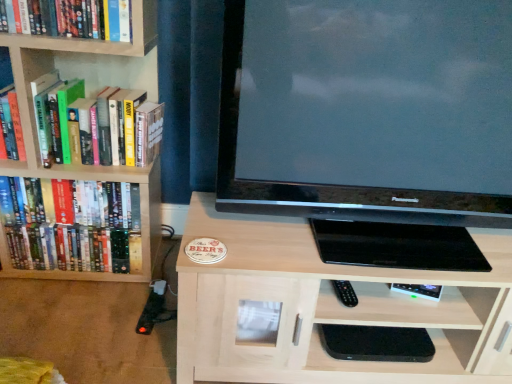
Question: Is light wood cabinet at center positioned far away from matte black television at center?

Choices:
 (A) no
 (B) yes

Answer: (A)

Question: Considering the relative sizes of light wood cabinet at center and matte black television at center in the image provided, is light wood cabinet at center smaller than matte black television at center?

Choices:
 (A) yes
 (B) no

Answer: (B)

Question: From the image's perspective, is light wood cabinet at center located beneath matte black television at center?

Choices:
 (A) yes
 (B) no

Answer: (A)

Question: Considering the relative sizes of light wood cabinet at center and matte black television at center in the image provided, is light wood cabinet at center thinner than matte black television at center?

Choices:
 (A) yes
 (B) no

Answer: (B)

Question: Is light wood cabinet at center outside matte black television at center?

Choices:
 (A) no
 (B) yes

Answer: (B)

Question: From the image's perspective, is wooden bookshelf at left located above or below hardcover books at left, positioned as the first book in bottom-to-top order?

Choices:
 (A) below
 (B) above

Answer: (B)

Question: In terms of width, does wooden bookshelf at left look wider or thinner when compared to hardcover books at left, positioned as the first book in bottom-to-top order?

Choices:
 (A) thin
 (B) wide

Answer: (B)

Question: Is point (138, 43) closer or farther from the camera than point (60, 266)?

Choices:
 (A) closer
 (B) farther

Answer: (A)

Question: In the image, is wooden bookshelf at left positioned in front of or behind hardcover books at left, the 3th book when ordered from top to bottom?

Choices:
 (A) behind
 (B) front

Answer: (B)

Question: Which is correct: hardcover books at left, which is counted as the second book, starting from the bottom, is inside hardcover book at upper left, positioned as the first book in top-to-bottom order, or outside of it?

Choices:
 (A) inside
 (B) outside

Answer: (B)

Question: In terms of size, does hardcover books at left, which is counted as the second book, starting from the bottom, appear bigger or smaller than hardcover book at upper left, positioned as the first book in top-to-bottom order?

Choices:
 (A) big
 (B) small

Answer: (A)

Question: From the image's perspective, relative to hardcover book at upper left, positioned as the first book in top-to-bottom order, is hardcover books at left, which ranks as the 2th book in top-to-bottom order, above or below?

Choices:
 (A) above
 (B) below

Answer: (B)

Question: Is hardcover books at left, which is counted as the second book, starting from the bottom, taller or shorter than hardcover book at upper left, positioned as the first book in top-to-bottom order?

Choices:
 (A) tall
 (B) short

Answer: (A)

Question: Considering their positions, is matte black television at center located in front of or behind hardcover books at left, positioned as the first book in bottom-to-top order?

Choices:
 (A) front
 (B) behind

Answer: (A)

Question: Considering the relative positions of matte black television at center and hardcover books at left, the 3th book when ordered from top to bottom, in the image provided, is matte black television at center to the left or to the right of hardcover books at left, the 3th book when ordered from top to bottom,?

Choices:
 (A) left
 (B) right

Answer: (B)